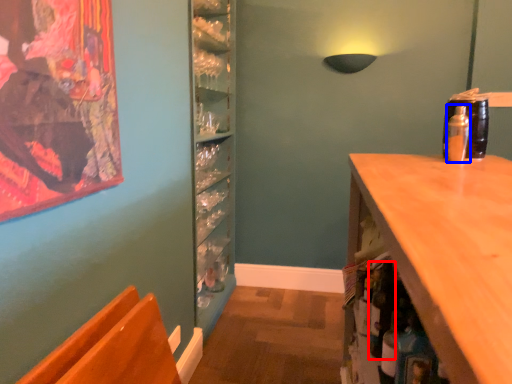
Question: Which point is further to the camera, bottle (highlighted by a red box) or bottle (highlighted by a blue box)?

Choices:
 (A) bottle
 (B) bottle

Answer: (B)